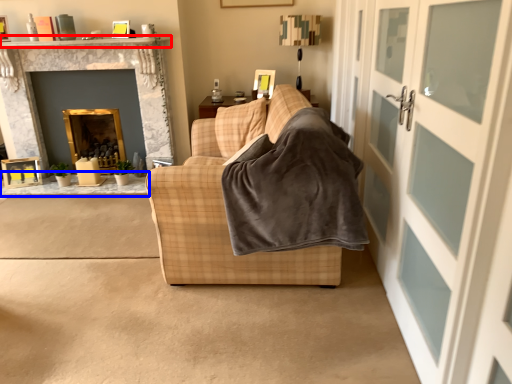
Question: Which of the following is the closest to the observer, mantle (highlighted by a red box) or table (highlighted by a blue box)?

Choices:
 (A) mantle
 (B) table

Answer: (A)